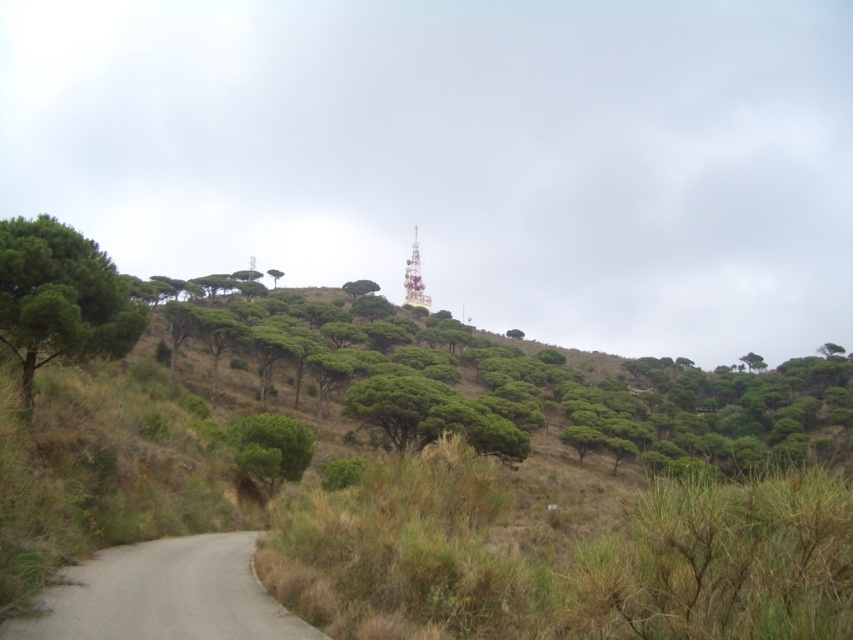
Question: Does green leafy tree at upper center have a greater width compared to gray gravel road at lower left?

Choices:
 (A) yes
 (B) no

Answer: (A)

Question: Among these points, which one is farthest from the camera?

Choices:
 (A) (294, 422)
 (B) (421, 305)
 (C) (131, 324)

Answer: (B)

Question: Observing the image, what is the correct spatial positioning of green leafy tree at left in reference to green matte tree at lower left?

Choices:
 (A) left
 (B) right

Answer: (A)

Question: Is green leafy tree at left bigger than metallic tower at center?

Choices:
 (A) no
 (B) yes

Answer: (A)

Question: Which of the following is the farthest from the observer?

Choices:
 (A) green leafy tree at left
 (B) green matte tree at upper center
 (C) gray gravel road at lower left
 (D) metallic tower at center

Answer: (D)

Question: Which point is farther to the camera?

Choices:
 (A) green matte tree at upper center
 (B) green leafy tree at left

Answer: (A)